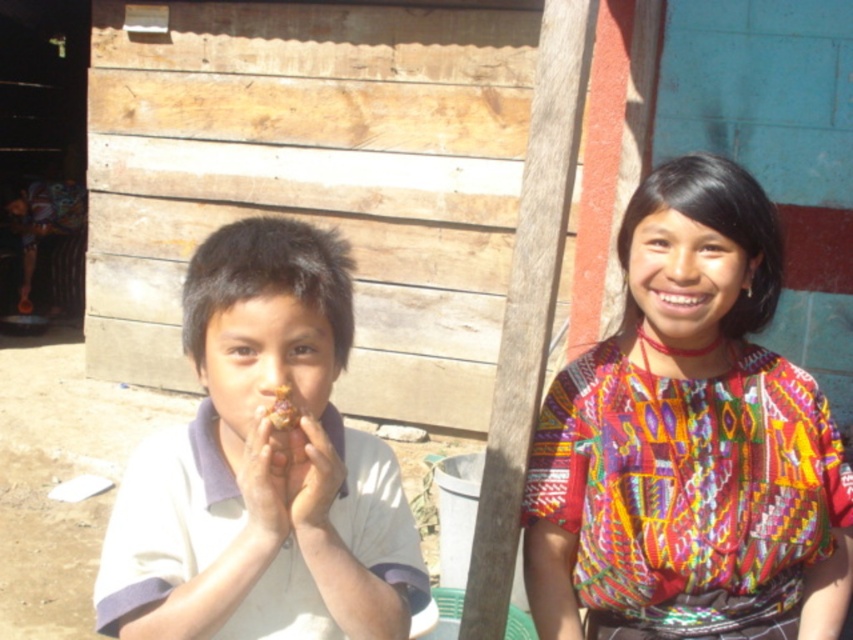
You are a photographer trying to capture a group photo of the multicolored woven blouse at right and the white cotton shirt at left. The camera you are using has a minimum focus distance of 24 inches. Will you be able to focus on both subjects without moving the camera or the subjects?

The distance between the multicolored woven blouse at right and the white cotton shirt at left is 22.96 inches, which is less than the camera minimum focus distance of 24 inches. Therefore, the camera cannot focus on both subjects simultaneously without adjusting the distance.

You are a photographer trying to capture both the multicolored woven blouse at right and the white cotton shirt at left in a single frame. Given that the camera can only focus on one subject at a time, which clothing item should you choose to ensure the entire garment is in focus, and why?

The multicolored woven blouse at right is larger in size than the white cotton shirt at left. To ensure the entire garment is in focus, you should choose the multicolored woven blouse at right because its larger size requires a closer focus distance, making it easier to capture the whole garment within the frame.

You are a photographer trying to capture a photo of the multicolored woven blouse at right and the yellow matte food at center. Based on their positions, which object should be placed closer to the camera to ensure both are in focus?

The multicolored woven blouse at right is much taller than the yellow matte food at center, so to ensure both are in focus, the yellow matte food at center should be moved closer to the camera until it reaches the same height as the multicolored woven blouse at right.